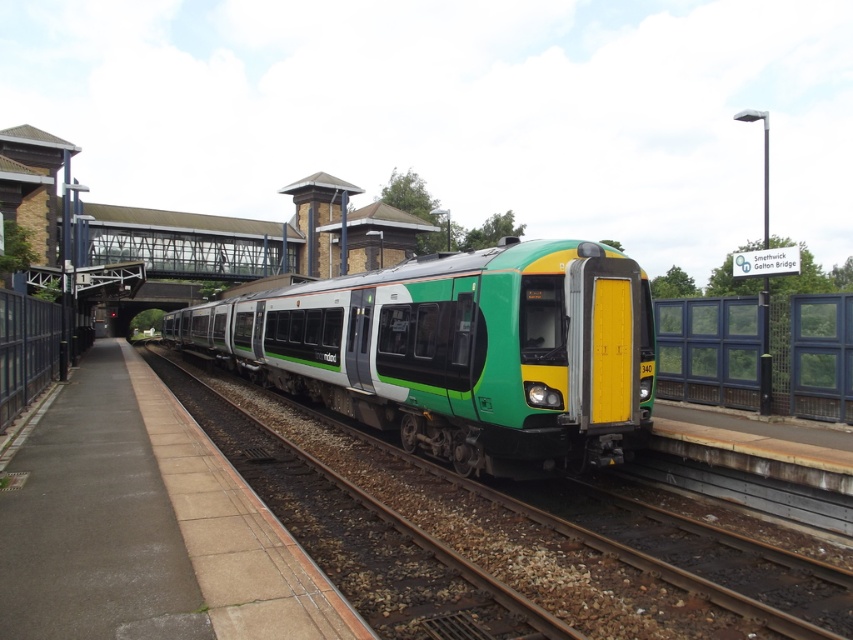
You are a passenger on the train platform and want to walk from the point marked as point (531, 358) to the point marked as point (839, 608). Which direction should you walk to reach your destination?

You should walk towards the front of the train because point (531, 358) is behind point (839, 608).

You are standing on the platform at the train station and see the green matte train at center and the green metallic train at center. Which one is positioned higher relative to the other?

The green matte train at center is located above the green metallic train at center, so it is positioned higher than the other.